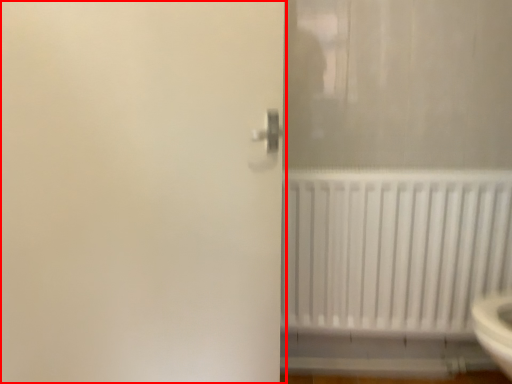
Question: From the image, what is the correct spatial relationship of screen door (annotated by the red box) in relation to radiator?

Choices:
 (A) right
 (B) left

Answer: (B)